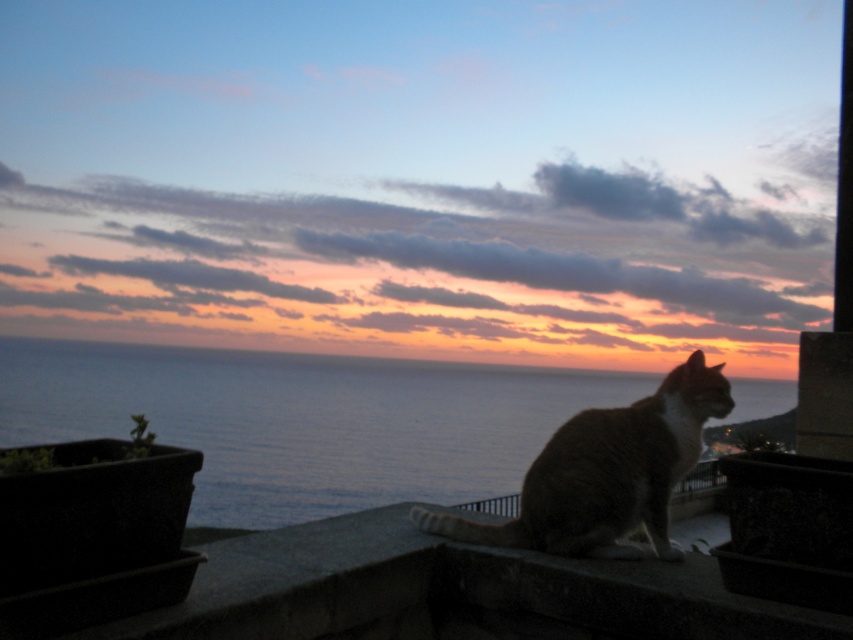
Does point (576, 609) come in front of point (527, 538)?

Yes, it is in front of point (527, 538).

Does point (703, 620) come farther from viewer compared to point (573, 435)?

No, (703, 620) is closer to viewer.

This screenshot has height=640, width=853. Find the location of `smooth concrete ledge at center`. smooth concrete ledge at center is located at coordinates (448, 592).

You are a GUI agent. You are given a task and a screenshot of the screen. Output one action in this format:
    pyautogui.click(x=<x>, y=<y>)
    Task: Click on the blue water at lower left
    Image resolution: width=853 pixels, height=640 pixels.
    Given the screenshot: What is the action you would take?
    302,420

Who is more distant from viewer, (433,413) or (62,637)?

Positioned behind is point (433,413).

Is point (775, 401) farther from camera compared to point (488, 568)?

Yes, point (775, 401) is farther from viewer.

You are a GUI agent. You are given a task and a screenshot of the screen. Output one action in this format:
    pyautogui.click(x=<x>, y=<y>)
    Task: Click on the blue water at lower left
    
    Given the screenshot: What is the action you would take?
    pyautogui.click(x=302, y=420)

Which is behind, point (86, 406) or point (630, 406)?

The point (86, 406) is behind.

Is point (506, 369) farther from viewer compared to point (531, 548)?

That is True.

This screenshot has height=640, width=853. What are the coordinates of `blue water at lower left` in the screenshot? It's located at (302, 420).